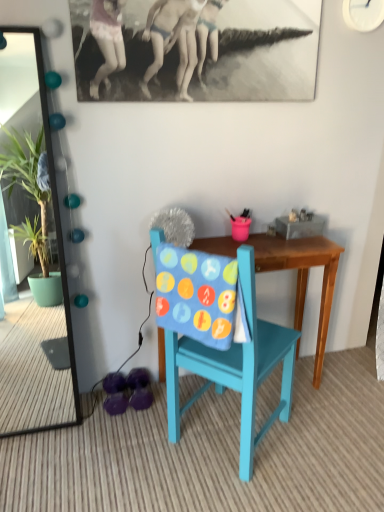
Identify the location of free space to the left of teal painted wood chair at center. (122, 450).